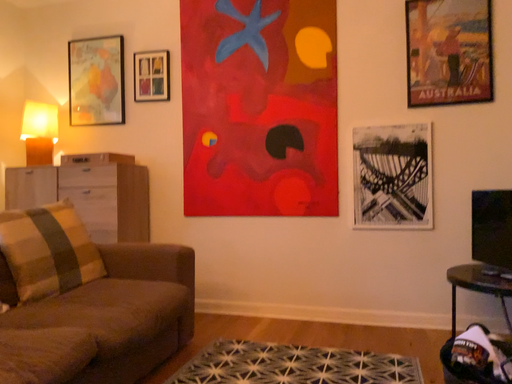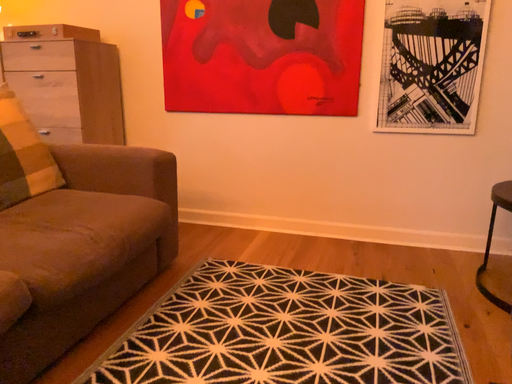
Question: Which way did the camera rotate in the video?

Choices:
 (A) rotated upward
 (B) rotated downward

Answer: (B)